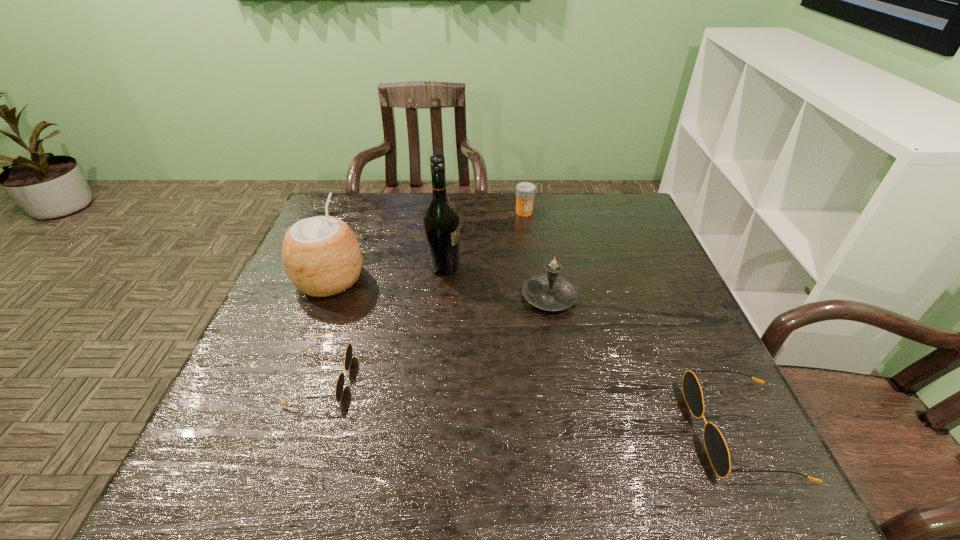
The image size is (960, 540). Find the location of `location for an additional sunglasses to make spacing equal`. location for an additional sunglasses to make spacing equal is located at coordinates (520, 403).